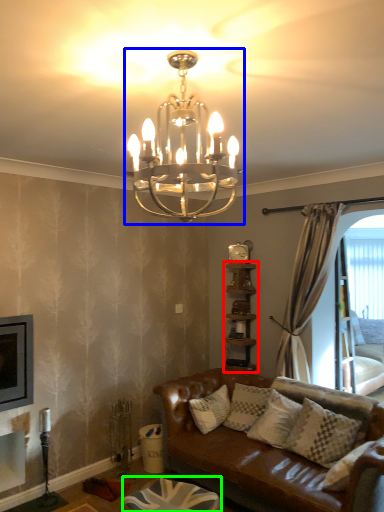
Question: Which is nearer to the shelf (highlighted by a red box)? lamp (highlighted by a blue box) or footrest (highlighted by a green box).

Choices:
 (A) lamp
 (B) footrest

Answer: (B)